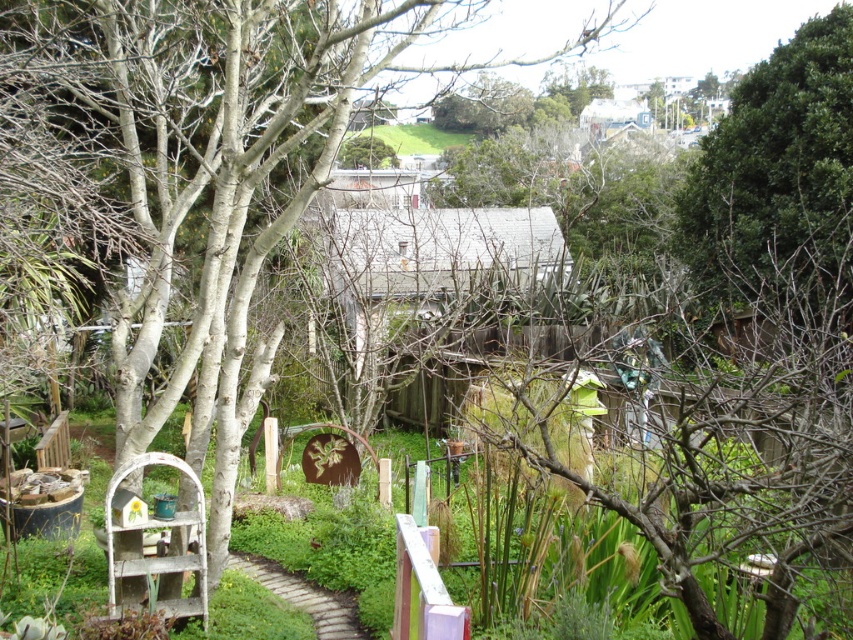
You are standing in the backyard and want to place a new decorative item. You have two points marked in the scene, point (x=840, y=148) and point (x=300, y=609). Which point is closer to you?

Point (x=840, y=148) is further to the viewer than point (x=300, y=609), so the closer point to you is point (x=300, y=609).

You are standing at the end of the brown brick path at lower center in the backyard. Looking towards the green leafy tree at upper right, where is the tree located relative to your position?

The green leafy tree at upper right is above the brown brick path at lower center, so when standing at the end of the path, the tree is located above and to the right of your position.